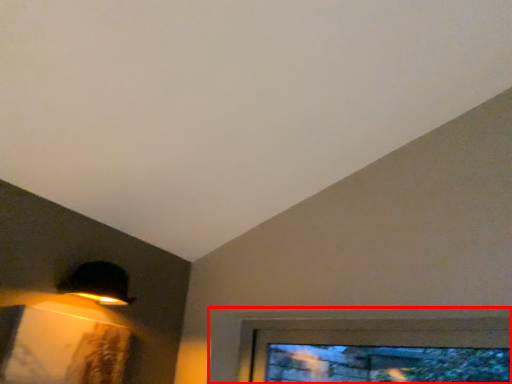
Question: Observing the image, what is the correct spatial positioning of window (annotated by the red box) in reference to lamp?

Choices:
 (A) right
 (B) left

Answer: (A)